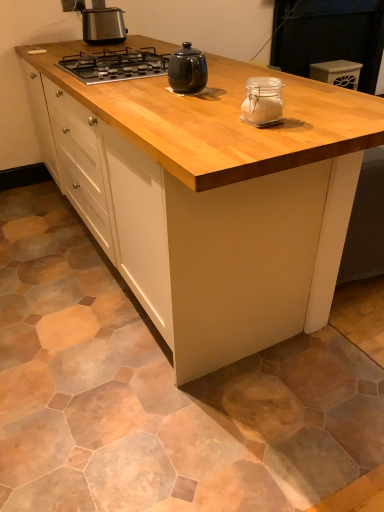
Locate an element on the screen. vacant area that lies between glossy ceramic mug at upper center, placed as the second kitchen appliance when sorted from back to front, and clear glass jar at center, which is the first kitchen appliance from front to back is located at coordinates (223, 103).